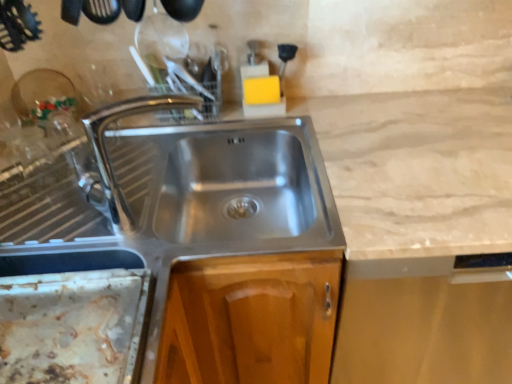
Question: Would you say rusty metal tray at lower left is to the left or to the right of chrome metallic tap at center in the picture?

Choices:
 (A) right
 (B) left

Answer: (B)

Question: Is point (18, 372) closer or farther from the camera than point (103, 195)?

Choices:
 (A) farther
 (B) closer

Answer: (B)

Question: In terms of width, does rusty metal tray at lower left look wider or thinner when compared to chrome metallic tap at center?

Choices:
 (A) wide
 (B) thin

Answer: (A)

Question: Do you think chrome metallic tap at center is within rusty metal tray at lower left, or outside of it?

Choices:
 (A) inside
 (B) outside

Answer: (B)

Question: In terms of width, does chrome metallic tap at center look wider or thinner when compared to rusty metal tray at lower left?

Choices:
 (A) wide
 (B) thin

Answer: (B)

Question: From a real-world perspective, is chrome metallic tap at center positioned above or below rusty metal tray at lower left?

Choices:
 (A) above
 (B) below

Answer: (A)

Question: Is point (89, 188) closer or farther from the camera than point (105, 294)?

Choices:
 (A) farther
 (B) closer

Answer: (A)